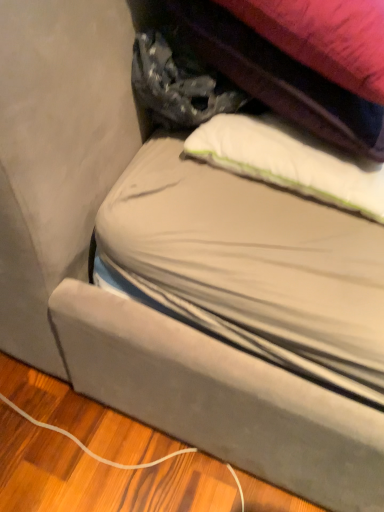
Question: Is white soft pillow at upper center taller or shorter than textured fabric bag at upper center?

Choices:
 (A) tall
 (B) short

Answer: (B)

Question: In the image, is white soft pillow at upper center on the left side or the right side of textured fabric bag at upper center?

Choices:
 (A) right
 (B) left

Answer: (A)

Question: From a real-world perspective, relative to textured fabric bag at upper center, is white soft pillow at upper center vertically above or below?

Choices:
 (A) below
 (B) above

Answer: (A)

Question: Is textured fabric bag at upper center wider or thinner than white soft pillow at upper center?

Choices:
 (A) wide
 (B) thin

Answer: (A)

Question: Is textured fabric bag at upper center taller or shorter than white soft pillow at upper center?

Choices:
 (A) tall
 (B) short

Answer: (A)

Question: From a real-world perspective, relative to white soft pillow at upper center, is textured fabric bag at upper center vertically above or below?

Choices:
 (A) above
 (B) below

Answer: (A)

Question: Based on their sizes in the image, would you say textured fabric bag at upper center is bigger or smaller than white soft pillow at upper center?

Choices:
 (A) big
 (B) small

Answer: (A)